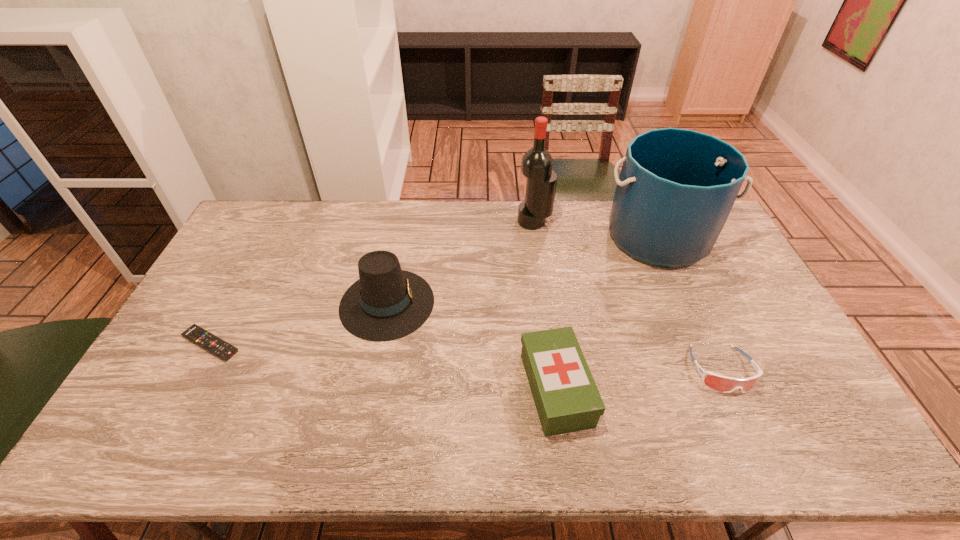
This screenshot has height=540, width=960. I want to click on wine bottle, so click(x=537, y=163).

This screenshot has height=540, width=960. What are the coordinates of `the fifth shortest object` in the screenshot? It's located at (676, 188).

Identify the location of the third tallest object. (387, 303).

This screenshot has height=540, width=960. What are the coordinates of `hat` in the screenshot? It's located at (387, 303).

Where is `the third shortest object`? the third shortest object is located at coordinates (566, 397).

You are a GUI agent. You are given a task and a screenshot of the screen. Output one action in this format:
    pyautogui.click(x=<x>, y=<y>)
    Task: Click on the goggles
    This screenshot has height=540, width=960.
    Given the screenshot: What is the action you would take?
    pyautogui.click(x=724, y=384)

The width and height of the screenshot is (960, 540). In order to click on the shortest object in this screenshot , I will do `click(222, 349)`.

Locate an element on the screen. The image size is (960, 540). remote control is located at coordinates (222, 349).

Image resolution: width=960 pixels, height=540 pixels. I want to click on vacant space situated 0.290m on the front of the tallest object, so click(543, 288).

Where is `free region located on the left of the fifth shortest object`? This screenshot has height=540, width=960. free region located on the left of the fifth shortest object is located at coordinates (523, 238).